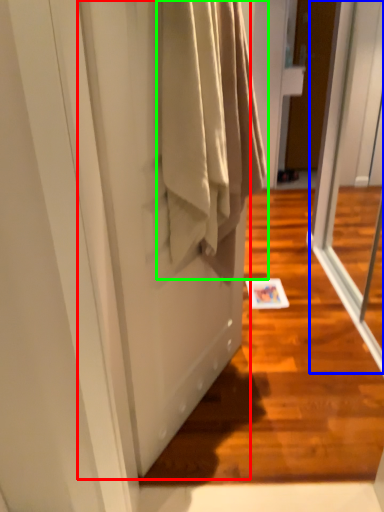
Question: Which is farther away from screen door (highlighted by a red box)? screen door (highlighted by a blue box) or clothing (highlighted by a green box)?

Choices:
 (A) screen door
 (B) clothing

Answer: (A)